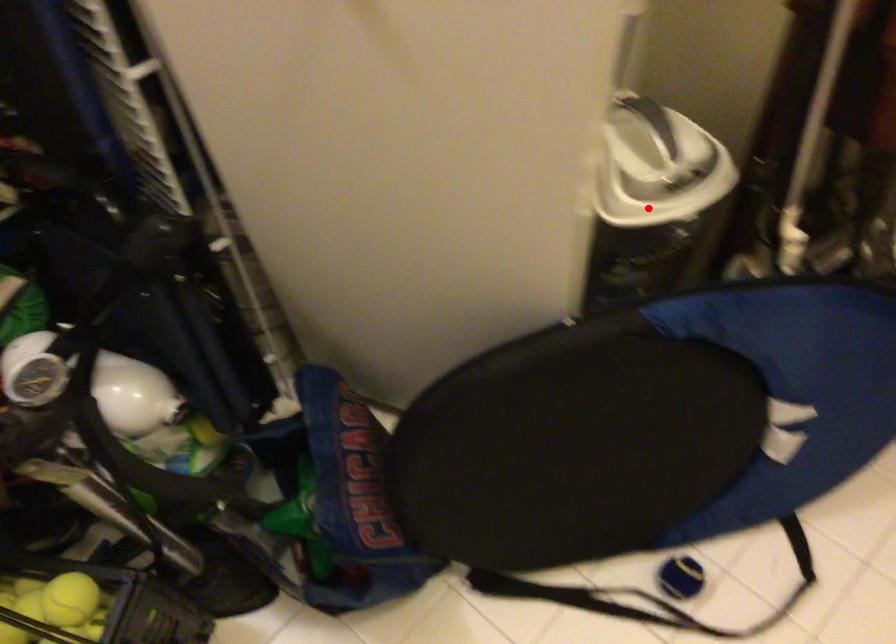
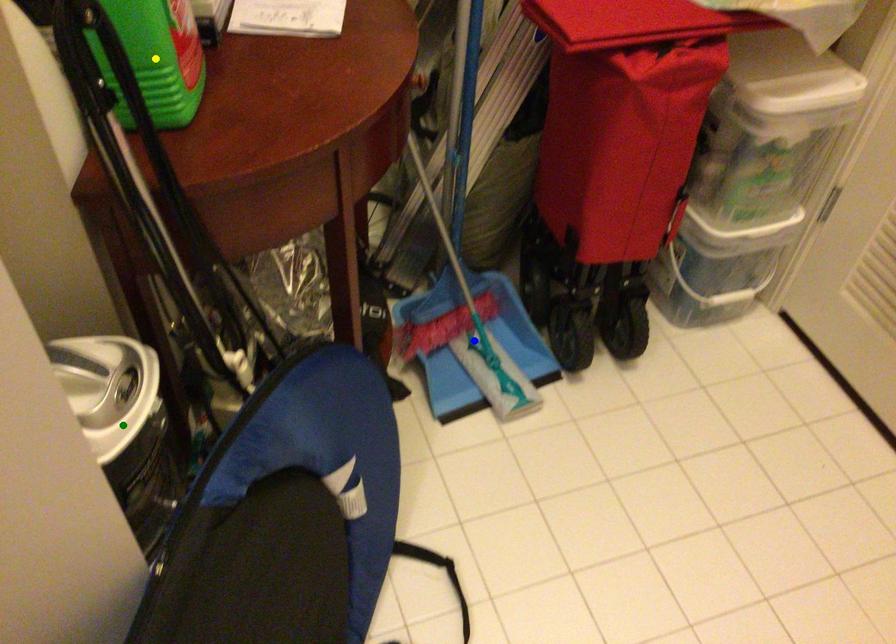
Question: I am providing you with two images of the same scene from different viewpoints. A red point is marked on the first image. You are given multiple points on the second image. Can you choose the point in image 2 that corresponds to the point in image 1?

Choices:
 (A) yellow point
 (B) green point
 (C) blue point

Answer: (B)